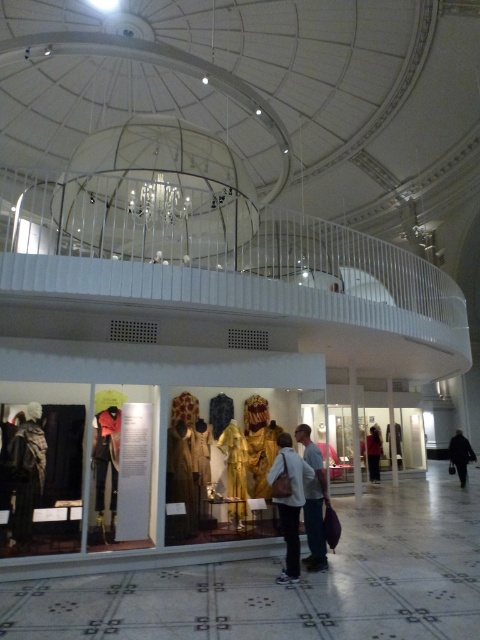
Question: Can you confirm if matte gold dress at center is positioned to the left of dark brown leather jacket at center?

Choices:
 (A) no
 (B) yes

Answer: (B)

Question: Which object is the closest to the gold textured fabric at center?

Choices:
 (A) dark brown leather jacket at lower left
 (B) matte gold dress at center
 (C) dark fabric bag at lower right
 (D) velvet red dress at lower left

Answer: (B)

Question: Which point is closer to the camera taking this photo?

Choices:
 (A) coord(370,436)
 (B) coord(229,465)
 (C) coord(111,528)
 (D) coord(276,436)

Answer: (C)

Question: Can you confirm if matte gold dress at center is positioned to the right of dark brown leather jacket at center?

Choices:
 (A) no
 (B) yes

Answer: (A)

Question: Which of the following is the farthest from the observer?

Choices:
 (A) (237, 472)
 (B) (15, 435)

Answer: (A)

Question: From the image, what is the correct spatial relationship of matte gold dress at center in relation to white cotton shirt at center?

Choices:
 (A) below
 (B) above

Answer: (B)